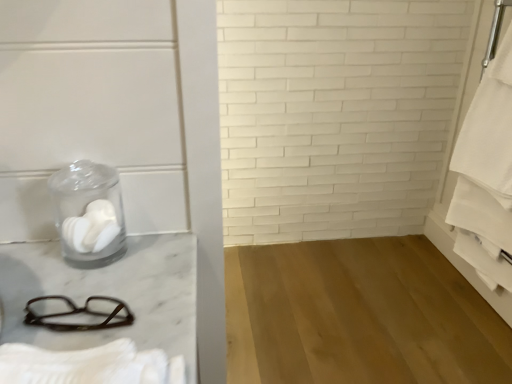
Question: Should I look upward or downward to see white cotton bath towel at lower left, marked as the 1th bath towel in a bottom-to-top arrangement?

Choices:
 (A) up
 (B) down

Answer: (B)

Question: Is white matte toilet paper at left directly adjacent to white cotton bath towel at lower left, positioned as the first bath towel in left-to-right order?

Choices:
 (A) no
 (B) yes

Answer: (A)

Question: Is white matte toilet paper at left behind white cotton bath towel at lower left, acting as the second bath towel starting from the back?

Choices:
 (A) no
 (B) yes

Answer: (B)

Question: Is white matte toilet paper at left closer to the viewer compared to white cotton bath towel at lower left, acting as the second bath towel starting from the back?

Choices:
 (A) yes
 (B) no

Answer: (B)

Question: Can you confirm if white matte toilet paper at left is positioned to the left of white cotton bath towel at lower left, which is the 2th bath towel from top to bottom?

Choices:
 (A) yes
 (B) no

Answer: (A)

Question: From a real-world perspective, does white matte toilet paper at left sit lower than white cotton bath towel at lower left, marked as the 1th bath towel in a bottom-to-top arrangement?

Choices:
 (A) yes
 (B) no

Answer: (B)

Question: Can you confirm if white matte toilet paper at left is smaller than white cotton bath towel at lower left, acting as the second bath towel starting from the right?

Choices:
 (A) yes
 (B) no

Answer: (A)

Question: Considering the relative positions of white cotton bath towel at lower left, positioned as the first bath towel in left-to-right order, and transparent glass jar at left in the image provided, is white cotton bath towel at lower left, positioned as the first bath towel in left-to-right order, behind transparent glass jar at left?

Choices:
 (A) no
 (B) yes

Answer: (A)

Question: From the image's perspective, does white cotton bath towel at lower left, the 1th bath towel positioned from the front, appear higher than transparent glass jar at left?

Choices:
 (A) no
 (B) yes

Answer: (A)

Question: Does white cotton bath towel at lower left, marked as the 1th bath towel in a bottom-to-top arrangement, lie in front of transparent glass jar at left?

Choices:
 (A) yes
 (B) no

Answer: (A)

Question: From a real-world perspective, is white cotton bath towel at lower left, which is the 2th bath towel from top to bottom, positioned under transparent glass jar at left based on gravity?

Choices:
 (A) no
 (B) yes

Answer: (B)

Question: Would you say white cotton bath towel at lower left, acting as the second bath towel starting from the right, is outside transparent glass jar at left?

Choices:
 (A) yes
 (B) no

Answer: (A)

Question: Does white cotton bath towel at lower left, acting as the second bath towel starting from the right, have a greater width compared to transparent glass jar at left?

Choices:
 (A) no
 (B) yes

Answer: (B)

Question: Can you confirm if white cotton bath towel at right, the second bath towel viewed from the left, is smaller than white matte toilet paper at left?

Choices:
 (A) yes
 (B) no

Answer: (B)